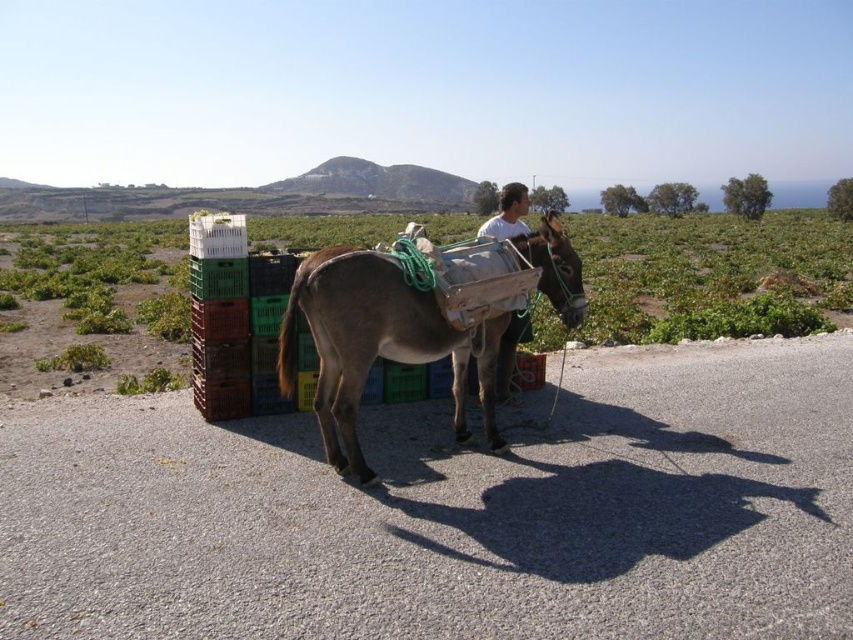
Between green plastic crates at center and brown textured donkey at center, which one is positioned higher?

Positioned higher is green plastic crates at center.

Does point (125, 252) come closer to viewer compared to point (583, 296)?

No, (125, 252) is behind (583, 296).

Identify the location of green plastic crates at center. The width and height of the screenshot is (853, 640). (712, 275).

Is brown textured donkey at center to the right of light brown leather pants at center from the viewer's perspective?

Result: No, brown textured donkey at center is not to the right of light brown leather pants at center.

Consider the image. Which of these two, brown textured donkey at center or light brown leather pants at center, stands taller?

light brown leather pants at center is taller.

In order to click on brown textured donkey at center in this screenshot , I will do `click(419, 317)`.

Where is `brown textured donkey at center`? Image resolution: width=853 pixels, height=640 pixels. brown textured donkey at center is located at coordinates (419, 317).

Is green plastic crates at center to the right of light brown leather pants at center from the viewer's perspective?

Yes, green plastic crates at center is to the right of light brown leather pants at center.

Is green plastic crates at center below light brown leather pants at center?

No.

Identify the location of green plastic crates at center. The width and height of the screenshot is (853, 640). (712, 275).

Find the location of a particular element. The image size is (853, 640). green plastic crates at center is located at coordinates (712, 275).